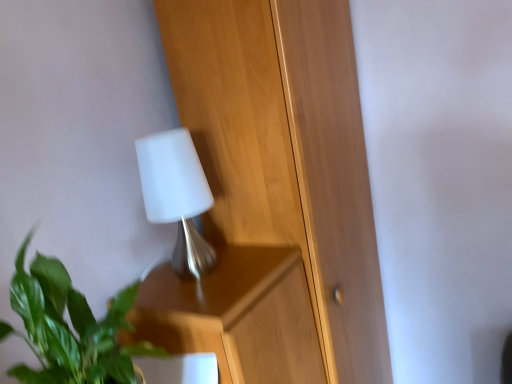
Question: Considering the relative sizes of wooden dresser at center and green leafy plant at lower left in the image provided, is wooden dresser at center shorter than green leafy plant at lower left?

Choices:
 (A) yes
 (B) no

Answer: (B)

Question: Could you tell me if wooden dresser at center is turned towards green leafy plant at lower left?

Choices:
 (A) no
 (B) yes

Answer: (A)

Question: Is wooden dresser at center facing away from green leafy plant at lower left?

Choices:
 (A) yes
 (B) no

Answer: (B)

Question: Can you confirm if wooden dresser at center is positioned to the right of green leafy plant at lower left?

Choices:
 (A) yes
 (B) no

Answer: (A)

Question: From a real-world perspective, is wooden dresser at center located beneath green leafy plant at lower left?

Choices:
 (A) no
 (B) yes

Answer: (B)

Question: Is wooden dresser at center beside green leafy plant at lower left?

Choices:
 (A) yes
 (B) no

Answer: (B)

Question: Is white matte lamp at upper center outside wooden dresser at center?

Choices:
 (A) no
 (B) yes

Answer: (B)

Question: Is white matte lamp at upper center facing away from wooden dresser at center?

Choices:
 (A) yes
 (B) no

Answer: (B)

Question: Can you confirm if white matte lamp at upper center is positioned to the left of wooden dresser at center?

Choices:
 (A) yes
 (B) no

Answer: (A)

Question: Is white matte lamp at upper center positioned behind wooden dresser at center?

Choices:
 (A) no
 (B) yes

Answer: (A)

Question: From a real-world perspective, is white matte lamp at upper center under wooden dresser at center?

Choices:
 (A) no
 (B) yes

Answer: (A)

Question: From the image's perspective, is white matte lamp at upper center above wooden dresser at center?

Choices:
 (A) yes
 (B) no

Answer: (A)

Question: From the image's perspective, is green leafy plant at lower left on top of white matte lamp at upper center?

Choices:
 (A) yes
 (B) no

Answer: (B)